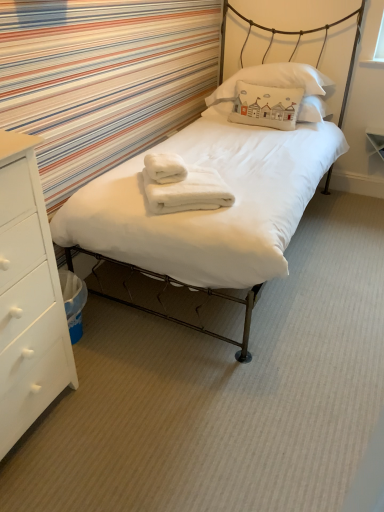
In order to click on white cotton pillow at upper center, the 1th pillow ordered from the bottom in this screenshot , I will do `click(266, 106)`.

Image resolution: width=384 pixels, height=512 pixels. I want to click on white fluffy bath towel at center, which appears as the first bath towel when ordered from the bottom, so click(x=182, y=185).

This screenshot has width=384, height=512. What do you see at coordinates (182, 185) in the screenshot? I see `white fluffy bath towel at center, which ranks as the 2th bath towel in top-to-bottom order` at bounding box center [182, 185].

Identify the location of white soft bed at center. The width and height of the screenshot is (384, 512). (218, 209).

This screenshot has height=512, width=384. Describe the element at coordinates (165, 167) in the screenshot. I see `white fluffy bath towel at center, acting as the first bath towel starting from the top` at that location.

In order to face white matte chest of drawers at left, should I rotate leftwards or rightwards?

A 28.144 degree turn to the left will do.

The image size is (384, 512). Find the location of `white cotton pillow at upper center, which is counted as the 2th pillow, starting from the top`. white cotton pillow at upper center, which is counted as the 2th pillow, starting from the top is located at coordinates (266, 106).

Can you confirm if white cotton pillow at upper center, the 1th pillow ordered from the bottom, is wider than white fluffy bath towel at center, which appears as the first bath towel when ordered from the bottom?

No, white cotton pillow at upper center, the 1th pillow ordered from the bottom, is not wider than white fluffy bath towel at center, which appears as the first bath towel when ordered from the bottom.

Who is smaller, white cotton pillow at upper center, which is counted as the 2th pillow, starting from the top, or white fluffy bath towel at center, which appears as the first bath towel when ordered from the bottom?

Smaller between the two is white fluffy bath towel at center, which appears as the first bath towel when ordered from the bottom.

From a real-world perspective, does white cotton pillow at upper center, the 1th pillow ordered from the bottom, sit lower than white fluffy bath towel at center, which ranks as the 2th bath towel in top-to-bottom order?

No, from a real-world perspective, white cotton pillow at upper center, the 1th pillow ordered from the bottom, is not under white fluffy bath towel at center, which ranks as the 2th bath towel in top-to-bottom order.

Does white cotton pillow at upper center, the 1th pillow ordered from the bottom, lie behind white fluffy bath towel at center, which ranks as the 2th bath towel in top-to-bottom order?

Yes, white cotton pillow at upper center, the 1th pillow ordered from the bottom, is further from the camera.

Considering the relative positions of white fluffy bath towel at center, placed as the 2th bath towel when sorted from bottom to top, and white cotton pillow at upper center, which is counted as the 2th pillow, starting from the top, in the image provided, is white fluffy bath towel at center, placed as the 2th bath towel when sorted from bottom to top, to the left or to the right of white cotton pillow at upper center, which is counted as the 2th pillow, starting from the top,?

white fluffy bath towel at center, placed as the 2th bath towel when sorted from bottom to top, is positioned on white cotton pillow at upper center, which is counted as the 2th pillow, starting from the top,'s left side.

What's the angular difference between white fluffy bath towel at center, acting as the first bath towel starting from the top, and white cotton pillow at upper center, which is counted as the 2th pillow, starting from the top,'s facing directions?

The angle between the facing direction of white fluffy bath towel at center, acting as the first bath towel starting from the top, and the facing direction of white cotton pillow at upper center, which is counted as the 2th pillow, starting from the top, is 126 degrees.

Is point (164, 161) less distant than point (262, 97)?

Yes.

From the image's perspective, which one is positioned lower, white fluffy bath towel at center, acting as the first bath towel starting from the top, or white cotton pillow at upper center, the 1th pillow ordered from the bottom?

white fluffy bath towel at center, acting as the first bath towel starting from the top.

Who is smaller, white cotton pillow at upper center, the 1th pillow ordered from the bottom, or white soft bed at center?

white cotton pillow at upper center, the 1th pillow ordered from the bottom.

Is point (244, 115) positioned in front of point (76, 233)?

No, (244, 115) is further to viewer.

Can you confirm if white cotton pillow at upper center, the 1th pillow ordered from the bottom, is positioned to the left of white soft bed at center?

Incorrect, white cotton pillow at upper center, the 1th pillow ordered from the bottom, is not on the left side of white soft bed at center.

Which of these two, white cotton pillow at upper center, the 1th pillow ordered from the bottom, or white soft bed at center, stands taller?

white soft bed at center.

Is white fluffy bath towel at center, acting as the first bath towel starting from the top, facing away from white cotton pillow at upper center, the 1th pillow from the top?

No, white cotton pillow at upper center, the 1th pillow from the top, is not at the back of white fluffy bath towel at center, acting as the first bath towel starting from the top.

Consider the image. From the image's perspective, which one is positioned higher, white fluffy bath towel at center, acting as the first bath towel starting from the top, or white cotton pillow at upper center, the 1th pillow from the top?

white cotton pillow at upper center, the 1th pillow from the top.

Between white fluffy bath towel at center, placed as the 2th bath towel when sorted from bottom to top, and white cotton pillow at upper center, the 1th pillow from the top, which one has smaller width?

Thinner between the two is white fluffy bath towel at center, placed as the 2th bath towel when sorted from bottom to top.

Would you say white cotton pillow at upper center, the 1th pillow ordered from the bottom, is a long distance from white cotton pillow at upper center, the second pillow in the bottom-to-top sequence?

Actually, white cotton pillow at upper center, the 1th pillow ordered from the bottom, and white cotton pillow at upper center, the second pillow in the bottom-to-top sequence, are a little close together.

Based on the photo, which of these two, white cotton pillow at upper center, which is counted as the 2th pillow, starting from the top, or white cotton pillow at upper center, the 1th pillow from the top, stands shorter?

Standing shorter between the two is white cotton pillow at upper center, which is counted as the 2th pillow, starting from the top.

From a real-world perspective, relative to white cotton pillow at upper center, the second pillow in the bottom-to-top sequence, is white cotton pillow at upper center, the 1th pillow ordered from the bottom, vertically above or below?

white cotton pillow at upper center, the 1th pillow ordered from the bottom, is situated lower than white cotton pillow at upper center, the second pillow in the bottom-to-top sequence, in the real world.

Which is more to the left, white cotton pillow at upper center, the 1th pillow ordered from the bottom, or white cotton pillow at upper center, the second pillow in the bottom-to-top sequence?

From the viewer's perspective, white cotton pillow at upper center, the 1th pillow ordered from the bottom, appears more on the left side.

Measure the distance between white matte chest of drawers at left and white fluffy bath towel at center, acting as the first bath towel starting from the top.

A distance of 31.79 inches exists between white matte chest of drawers at left and white fluffy bath towel at center, acting as the first bath towel starting from the top.

From the image's perspective, is white matte chest of drawers at left beneath white fluffy bath towel at center, placed as the 2th bath towel when sorted from bottom to top?

Indeed, from the image's perspective, white matte chest of drawers at left is shown beneath white fluffy bath towel at center, placed as the 2th bath towel when sorted from bottom to top.

From the picture: Is white matte chest of drawers at left to the right of white fluffy bath towel at center, acting as the first bath towel starting from the top, from the viewer's perspective?

Incorrect, white matte chest of drawers at left is not on the right side of white fluffy bath towel at center, acting as the first bath towel starting from the top.

From a real-world perspective, is white matte chest of drawers at left on top of white fluffy bath towel at center, acting as the first bath towel starting from the top?

No, from a real-world perspective, white matte chest of drawers at left is not on top of white fluffy bath towel at center, acting as the first bath towel starting from the top.

Is white fluffy bath towel at center, which ranks as the 2th bath towel in top-to-bottom order, oriented away from white matte chest of drawers at left?

No, white fluffy bath towel at center, which ranks as the 2th bath towel in top-to-bottom order,'s orientation is not away from white matte chest of drawers at left.

From the image's perspective, who appears lower, white fluffy bath towel at center, which ranks as the 2th bath towel in top-to-bottom order, or white matte chest of drawers at left?

From the image's view, white matte chest of drawers at left is below.

Find the location of a particular element. The height and width of the screenshot is (512, 384). the 1st bath towel behind the white matte chest of drawers at left is located at coordinates (182, 185).

From the image's perspective, which pillow is the 1st one above the white fluffy bath towel at center, which ranks as the 2th bath towel in top-to-bottom order? Please provide its 2D coordinates.

[(266, 106)]

Which pillow is the 2nd one when counting from the back of the white fluffy bath towel at center, acting as the first bath towel starting from the top? Please provide its 2D coordinates.

[(266, 106)]

Which object lies further to the anchor point white cotton pillow at upper center, the 1th pillow from the top, white matte chest of drawers at left or white fluffy bath towel at center, acting as the first bath towel starting from the top?

white matte chest of drawers at left lies further to white cotton pillow at upper center, the 1th pillow from the top, than the other object.

Estimate the real-world distances between objects in this image. Which object is further from white cotton pillow at upper center, which is counted as the 2th pillow, starting from the top, white fluffy bath towel at center, placed as the 2th bath towel when sorted from bottom to top, or white fluffy bath towel at center, which ranks as the 2th bath towel in top-to-bottom order?

Among the two, white fluffy bath towel at center, which ranks as the 2th bath towel in top-to-bottom order, is located further to white cotton pillow at upper center, which is counted as the 2th pillow, starting from the top.

When comparing their distances from white matte chest of drawers at left, does white cotton pillow at upper center, the second pillow in the bottom-to-top sequence, or white cotton pillow at upper center, the 1th pillow ordered from the bottom, seem closer?

white cotton pillow at upper center, the 1th pillow ordered from the bottom, lies closer to white matte chest of drawers at left than the other object.

Based on the photo, which object lies nearer to the anchor point white matte chest of drawers at left, white cotton pillow at upper center, the 1th pillow ordered from the bottom, or white fluffy bath towel at center, which appears as the first bath towel when ordered from the bottom?

white fluffy bath towel at center, which appears as the first bath towel when ordered from the bottom, is closer to white matte chest of drawers at left.

Based on their spatial positions, is white fluffy bath towel at center, placed as the 2th bath towel when sorted from bottom to top, or white cotton pillow at upper center, the second pillow in the bottom-to-top sequence, closer to white matte chest of drawers at left?

white fluffy bath towel at center, placed as the 2th bath towel when sorted from bottom to top, lies closer to white matte chest of drawers at left than the other object.

Looking at the image, which one is located further to white matte chest of drawers at left, white soft bed at center or white cotton pillow at upper center, the 1th pillow from the top?

white cotton pillow at upper center, the 1th pillow from the top, is further to white matte chest of drawers at left.

Looking at the image, which one is located further to white cotton pillow at upper center, the second pillow in the bottom-to-top sequence, white fluffy bath towel at center, which appears as the first bath towel when ordered from the bottom, or white cotton pillow at upper center, the 1th pillow ordered from the bottom?

Based on the image, white fluffy bath towel at center, which appears as the first bath towel when ordered from the bottom, appears to be further to white cotton pillow at upper center, the second pillow in the bottom-to-top sequence.

Looking at the image, which one is located closer to white fluffy bath towel at center, placed as the 2th bath towel when sorted from bottom to top, white fluffy bath towel at center, which ranks as the 2th bath towel in top-to-bottom order, or white soft bed at center?

white fluffy bath towel at center, which ranks as the 2th bath towel in top-to-bottom order, lies closer to white fluffy bath towel at center, placed as the 2th bath towel when sorted from bottom to top, than the other object.

The height and width of the screenshot is (512, 384). Find the location of `bath towel located between white fluffy bath towel at center, which ranks as the 2th bath towel in top-to-bottom order, and white cotton pillow at upper center, which is counted as the 2th pillow, starting from the top, in the depth direction`. bath towel located between white fluffy bath towel at center, which ranks as the 2th bath towel in top-to-bottom order, and white cotton pillow at upper center, which is counted as the 2th pillow, starting from the top, in the depth direction is located at coordinates (165, 167).

Locate an element on the screen. bed between white matte chest of drawers at left and white cotton pillow at upper center, the 1th pillow from the top, from front to back is located at coordinates (218, 209).

At what (x,y) coordinates should I click in order to perform the action: click on bed located between white matte chest of drawers at left and white fluffy bath towel at center, placed as the 2th bath towel when sorted from bottom to top, in the depth direction. Please return your answer as a coordinate pair (x, y). The image size is (384, 512). Looking at the image, I should click on (218, 209).

Where is `bed positioned between white matte chest of drawers at left and white cotton pillow at upper center, which is counted as the 2th pillow, starting from the top, from near to far`? Image resolution: width=384 pixels, height=512 pixels. bed positioned between white matte chest of drawers at left and white cotton pillow at upper center, which is counted as the 2th pillow, starting from the top, from near to far is located at coordinates (218, 209).